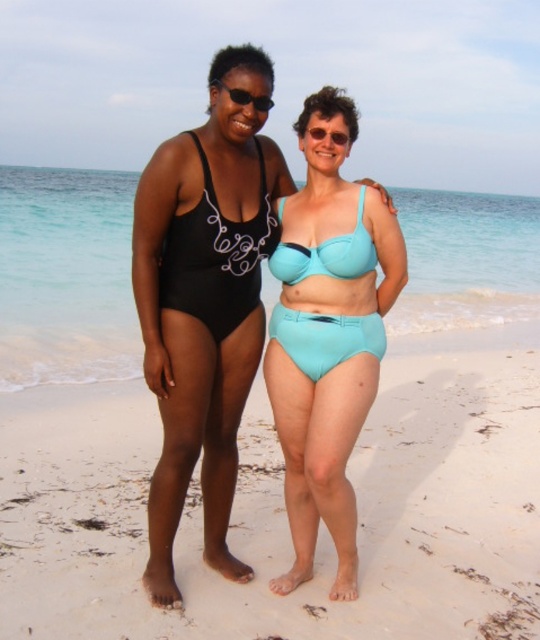
Who is higher up, matte blue bikini at center or transparent plastic goggles at center?

Positioned higher is transparent plastic goggles at center.

Identify the location of matte blue bikini at center. (325, 337).

Locate an element on the screen. This screenshot has width=540, height=640. matte blue bikini at center is located at coordinates (325, 337).

Between matte blue bikini at center and black plastic sunglasses at upper center, which one is positioned higher?

Positioned higher is black plastic sunglasses at upper center.

What do you see at coordinates (325, 337) in the screenshot? The height and width of the screenshot is (640, 540). I see `matte blue bikini at center` at bounding box center [325, 337].

Which is behind, point (278, 314) or point (235, 90)?

Positioned behind is point (278, 314).

Where is `matte blue bikini at center`? The height and width of the screenshot is (640, 540). matte blue bikini at center is located at coordinates (325, 337).

Between matte black swimsuit at center and black matte swimsuit at center, which one appears on the right side from the viewer's perspective?

black matte swimsuit at center

What do you see at coordinates (202, 316) in the screenshot? I see `matte black swimsuit at center` at bounding box center [202, 316].

Is point (185, 323) less distant than point (259, 276)?

Yes, point (185, 323) is in front of point (259, 276).

Identify the location of matte black swimsuit at center. This screenshot has height=640, width=540. (202, 316).